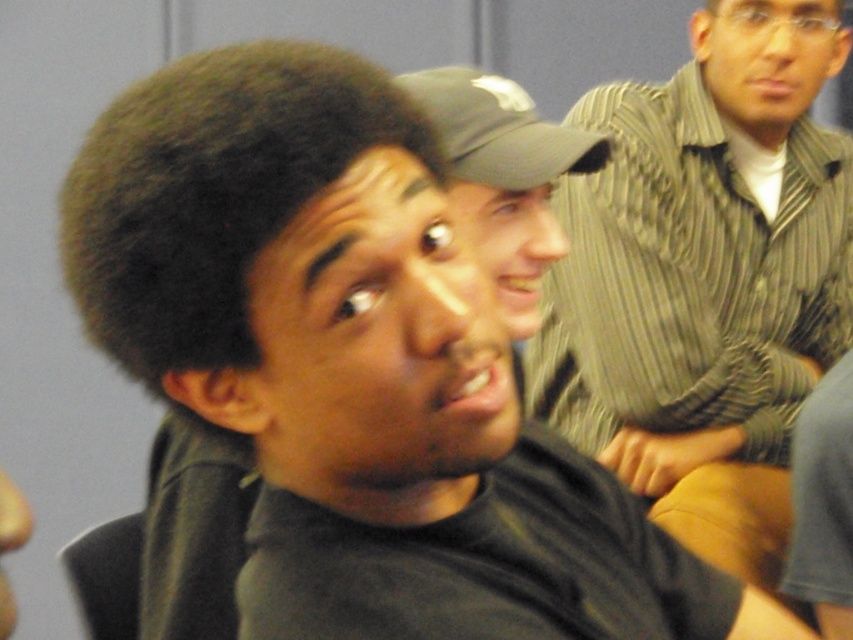
Is the position of striped button-up shirt at upper right less distant than that of dark gray fabric baseball cap at upper center?

No, it is not.

Image resolution: width=853 pixels, height=640 pixels. Describe the element at coordinates (705, 276) in the screenshot. I see `striped button-up shirt at upper right` at that location.

At what (x,y) coordinates should I click in order to perform the action: click on striped button-up shirt at upper right. Please return your answer as a coordinate pair (x, y). Image resolution: width=853 pixels, height=640 pixels. Looking at the image, I should click on (705, 276).